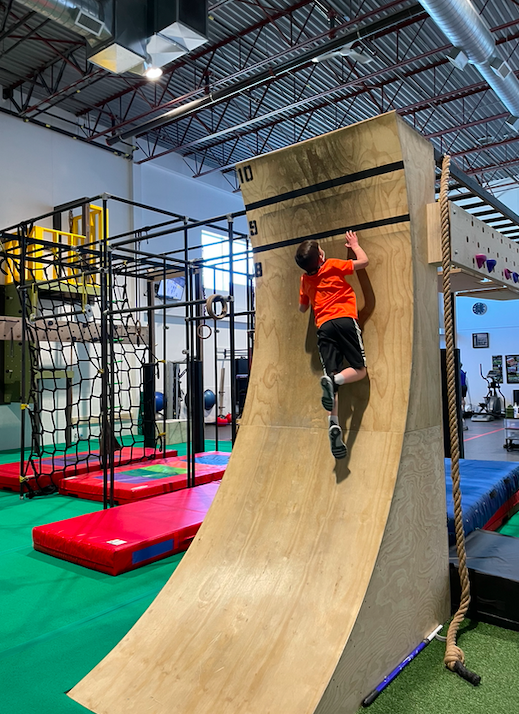
In order to click on ceiling in this screenshot , I will do `click(273, 45)`.